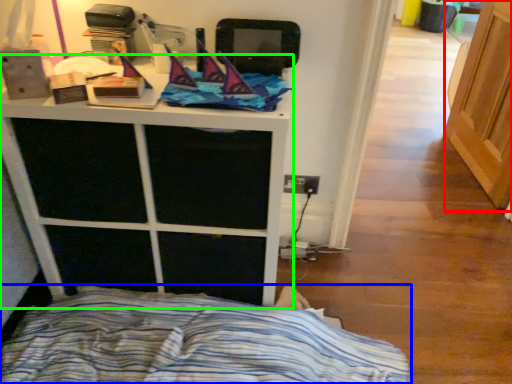
Question: Estimate the real-world distances between objects in this image. Which object is closer to screen door (highlighted by a red box), bed (highlighted by a blue box) or furniture (highlighted by a green box)?

Choices:
 (A) bed
 (B) furniture

Answer: (A)